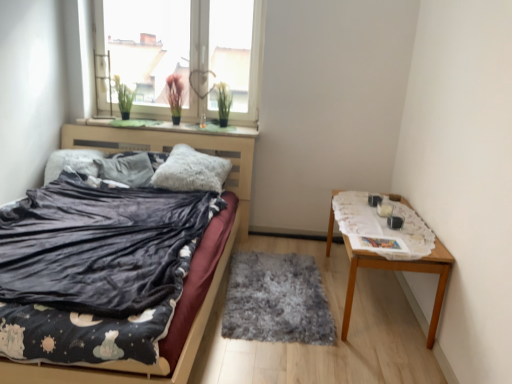
Locate an element on the screen. This screenshot has height=384, width=512. free space below fuzzy gray rug at center (from a real-world perspective) is located at coordinates (273, 292).